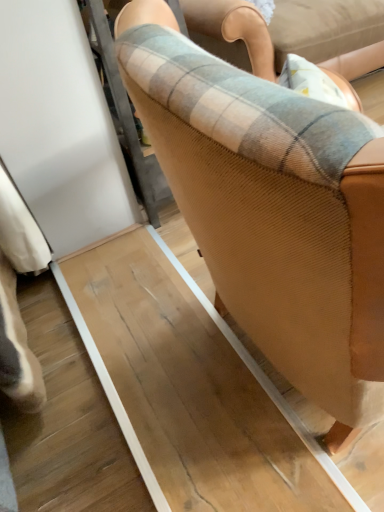
Question: Should I look upward or downward to see plaid fabric at center?

Choices:
 (A) up
 (B) down

Answer: (A)

Question: Is plaid fabric at center not near brown textured chair at center?

Choices:
 (A) no
 (B) yes

Answer: (A)

Question: From the image's perspective, is plaid fabric at center located above brown textured chair at center?

Choices:
 (A) yes
 (B) no

Answer: (A)

Question: Is plaid fabric at center positioned in front of brown textured chair at center?

Choices:
 (A) no
 (B) yes

Answer: (A)

Question: Would you say plaid fabric at center is outside brown textured chair at center?

Choices:
 (A) yes
 (B) no

Answer: (A)

Question: Considering the relative positions of plaid fabric at center and brown textured chair at center in the image provided, is plaid fabric at center to the left of brown textured chair at center from the viewer's perspective?

Choices:
 (A) no
 (B) yes

Answer: (A)

Question: Can you confirm if plaid fabric at center is positioned to the right of brown textured chair at center?

Choices:
 (A) no
 (B) yes

Answer: (B)

Question: Is brown textured chair at center aimed at plaid fabric at center?

Choices:
 (A) no
 (B) yes

Answer: (A)

Question: From the image's perspective, is brown textured chair at center below plaid fabric at center?

Choices:
 (A) yes
 (B) no

Answer: (A)

Question: Is brown textured chair at center closer to the viewer compared to plaid fabric at center?

Choices:
 (A) no
 (B) yes

Answer: (B)

Question: From the image's perspective, does brown textured chair at center appear higher than plaid fabric at center?

Choices:
 (A) no
 (B) yes

Answer: (A)

Question: Is brown textured chair at center bigger than plaid fabric at center?

Choices:
 (A) no
 (B) yes

Answer: (A)

Question: Is brown textured chair at center far away from plaid fabric at center?

Choices:
 (A) yes
 (B) no

Answer: (B)

Question: Looking at their shapes, would you say plaid fabric at center is wider or thinner than brown textured chair at center?

Choices:
 (A) wide
 (B) thin

Answer: (A)